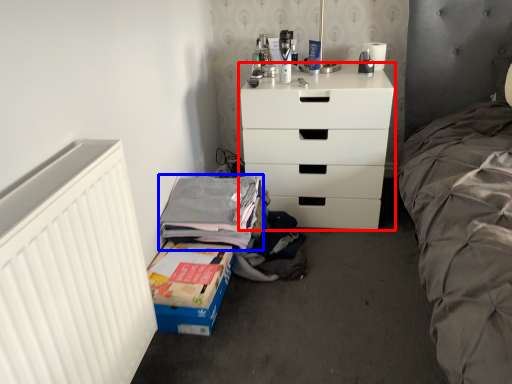
Question: Which object appears farthest to the camera in this image, chest of drawers (highlighted by a red box) or clothing (highlighted by a blue box)?

Choices:
 (A) chest of drawers
 (B) clothing

Answer: (A)